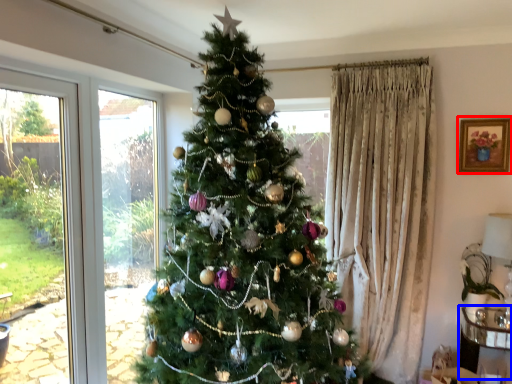
Question: Which of the following is the closest to the observer, picture frame (highlighted by a red box) or furniture (highlighted by a blue box)?

Choices:
 (A) picture frame
 (B) furniture

Answer: (B)